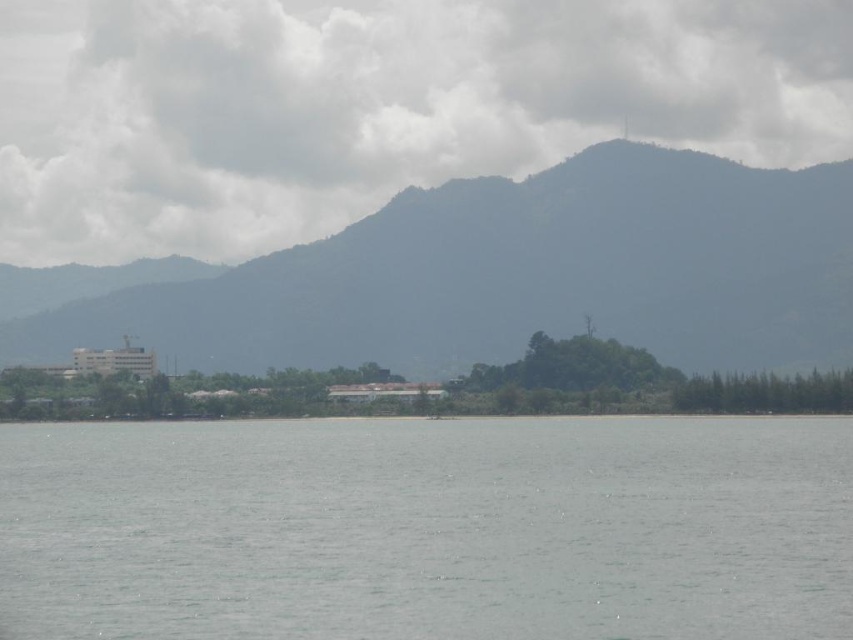
Question: Is gray water at center in front of white fluffy cloud at upper center?

Choices:
 (A) no
 (B) yes

Answer: (B)

Question: Which object is positioned farthest from the gray water at center?

Choices:
 (A) white fluffy cloud at upper center
 (B) green textured mountain at center

Answer: (A)

Question: Considering the relative positions of gray water at center and green textured mountain at center in the image provided, where is gray water at center located with respect to green textured mountain at center?

Choices:
 (A) above
 (B) below

Answer: (B)

Question: Which object is the closest to the gray water at center?

Choices:
 (A) green textured mountain at center
 (B) white fluffy cloud at upper center

Answer: (A)

Question: Is gray water at center smaller than green textured mountain at center?

Choices:
 (A) no
 (B) yes

Answer: (A)

Question: Which of these objects is positioned closest to the gray water at center?

Choices:
 (A) green textured mountain at center
 (B) white fluffy cloud at upper center

Answer: (A)